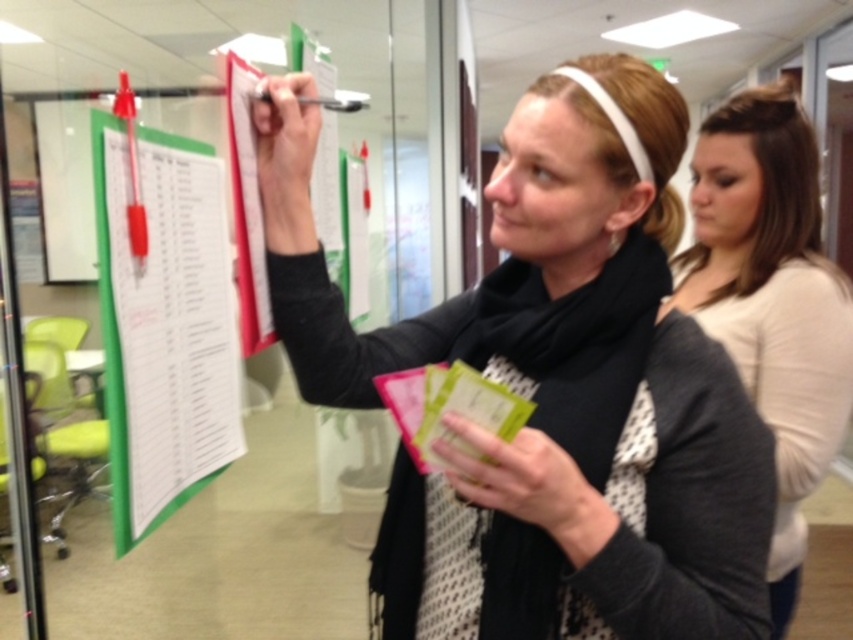
You are a delivery person entering an office and see the black matte scarf at upper center and the white matte shirt at upper right. Which clothing item is closer to you?

The black matte scarf at upper center is closer to you because it is in front of the white matte shirt at upper right.

You are standing in an office and want to reach the point at coordinates point (535,508). If you can extend your arm 70 centimeters, will you be able to reach it?

The distance between you and point (535,508) is 73.84 centimeters. Since your arm can only extend 70 centimeters, you cannot reach it.

You are a delivery person who needs to hand over a package to the woman at the office. The package must be placed on the surface between the black matte scarf at upper center and the green paperboard at left. Is the space between them sufficient to place the package?

The black matte scarf at upper center is below the green paperboard at left, so the space between them may not be sufficient to place the package as they are vertically aligned rather than horizontally separated.